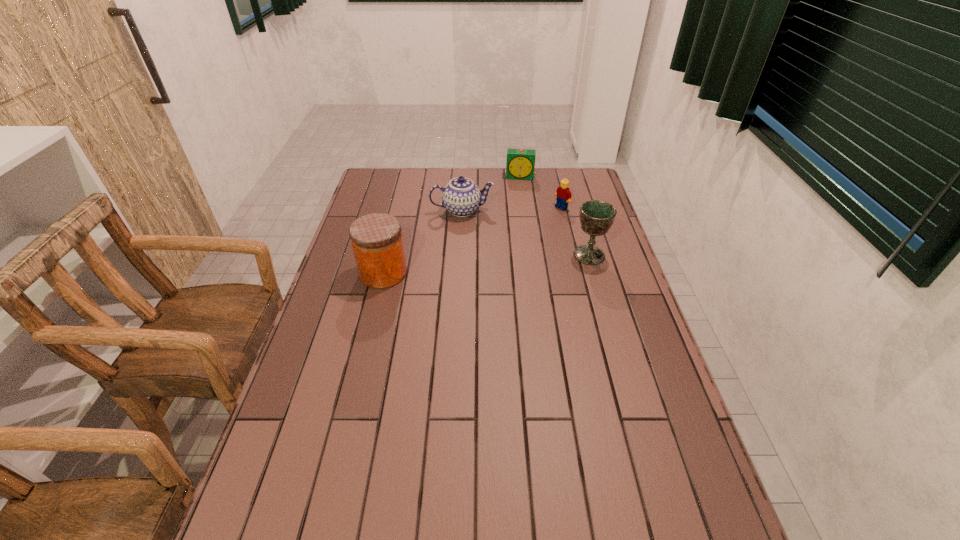
This screenshot has width=960, height=540. In order to click on vacant area situated on the front-facing side of the farthest object in this screenshot , I will do `click(518, 191)`.

Where is `vacant region located on the front-facing side of the farthest object`? The height and width of the screenshot is (540, 960). vacant region located on the front-facing side of the farthest object is located at coordinates (518, 193).

You are a GUI agent. You are given a task and a screenshot of the screen. Output one action in this format:
    pyautogui.click(x=<x>, y=<y>)
    Task: Click on the vacant area situated 0.250m on the front-facing side of the Lego
    The image size is (960, 540).
    Given the screenshot: What is the action you would take?
    pyautogui.click(x=512, y=239)

The width and height of the screenshot is (960, 540). In order to click on blank area located 0.280m on the front-facing side of the Lego in this screenshot , I will do `click(506, 242)`.

Identify the location of vacant area situated 0.390m on the front-facing side of the Lego. This screenshot has width=960, height=540. (483, 256).

This screenshot has height=540, width=960. Find the location of `vacant space located at the spout of the chinaware`. vacant space located at the spout of the chinaware is located at coordinates (471, 274).

Locate an element on the screen. This screenshot has height=540, width=960. vacant space located 0.300m at the spout of the chinaware is located at coordinates (471, 276).

Find the location of a particular element. The height and width of the screenshot is (540, 960). blank space located 0.220m at the spout of the chinaware is located at coordinates (469, 260).

What are the coordinates of `object situated at the far edge` in the screenshot? It's located at (520, 164).

Where is `object at the left edge`? object at the left edge is located at coordinates (376, 239).